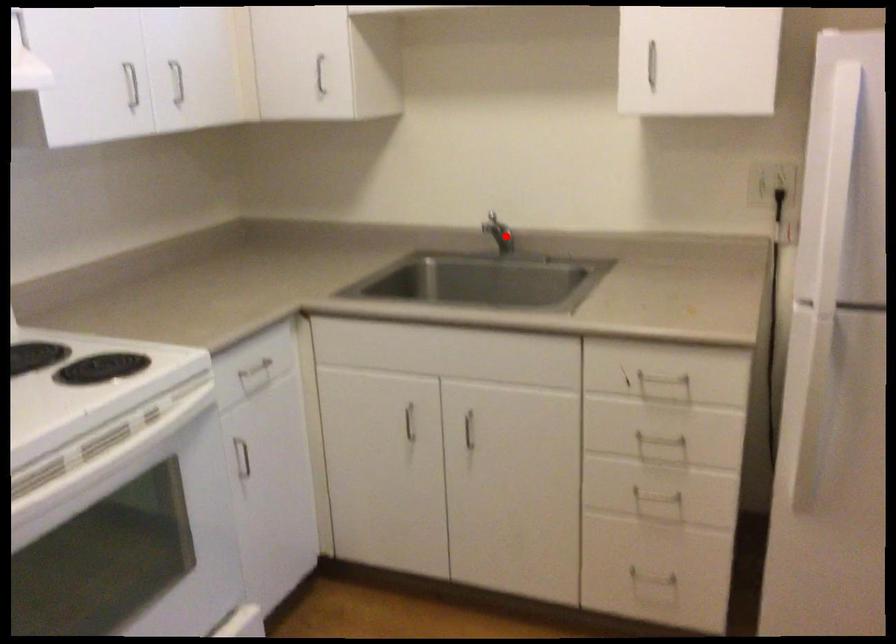
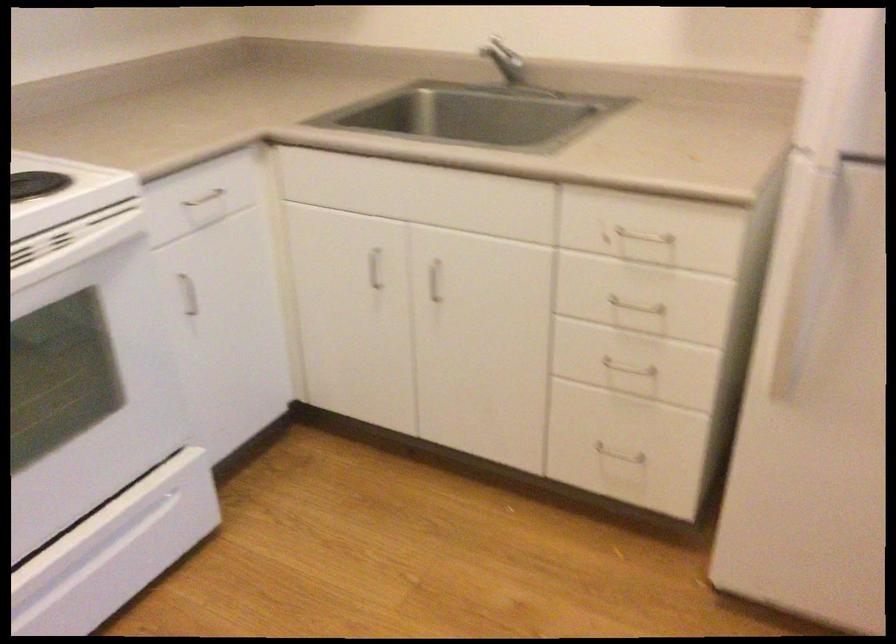
Find the pixel in the second image that matches the highlighted location in the first image.

(510, 68)